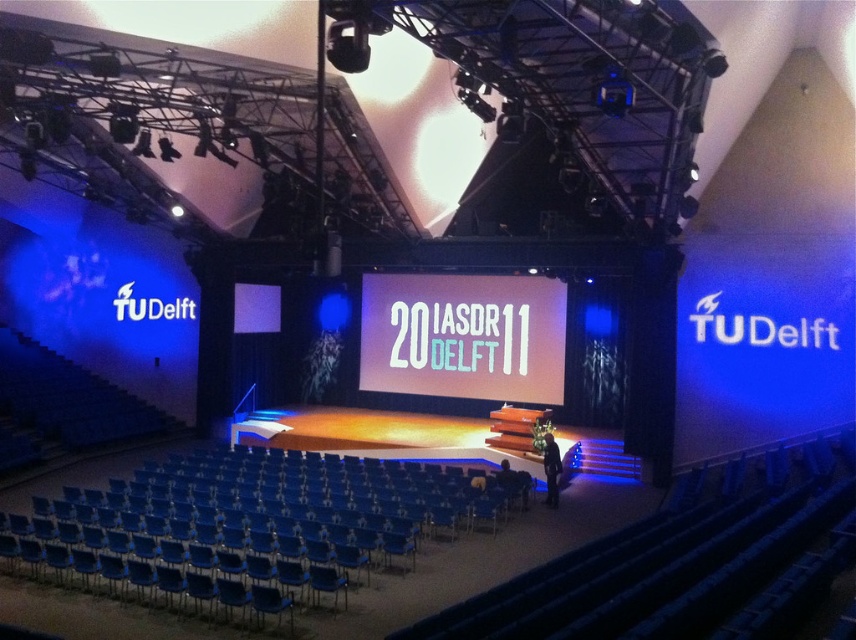
Question: Which of the following is the closest to the observer?

Choices:
 (A) blue plastic chair at lower center
 (B) white matte projection screen at center

Answer: (A)

Question: Does blue plastic chair at lower center come behind white matte projection screen at center?

Choices:
 (A) yes
 (B) no

Answer: (B)

Question: Is blue plastic chair at lower center above white matte projection screen at center?

Choices:
 (A) no
 (B) yes

Answer: (A)

Question: Is blue plastic chair at lower center wider than white matte projection screen at center?

Choices:
 (A) yes
 (B) no

Answer: (B)